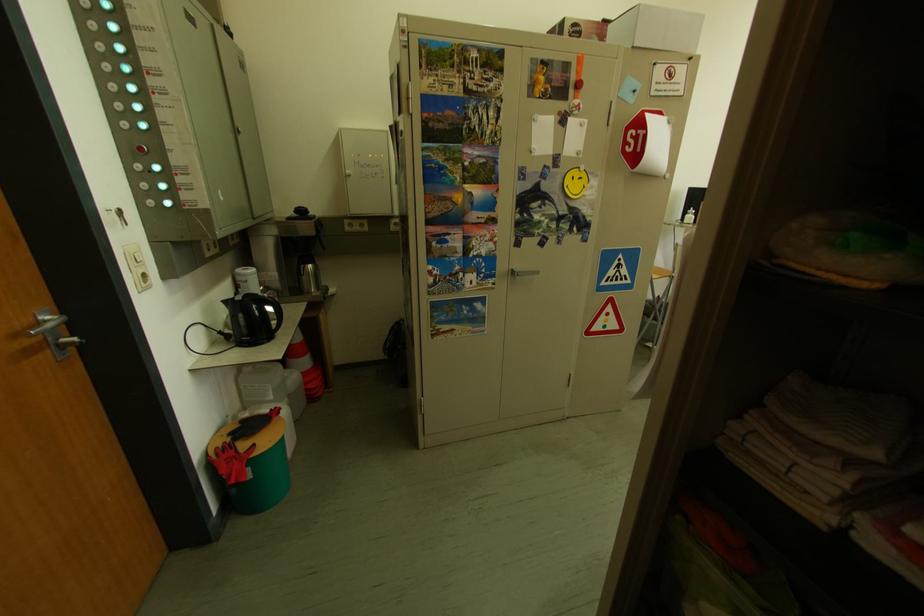
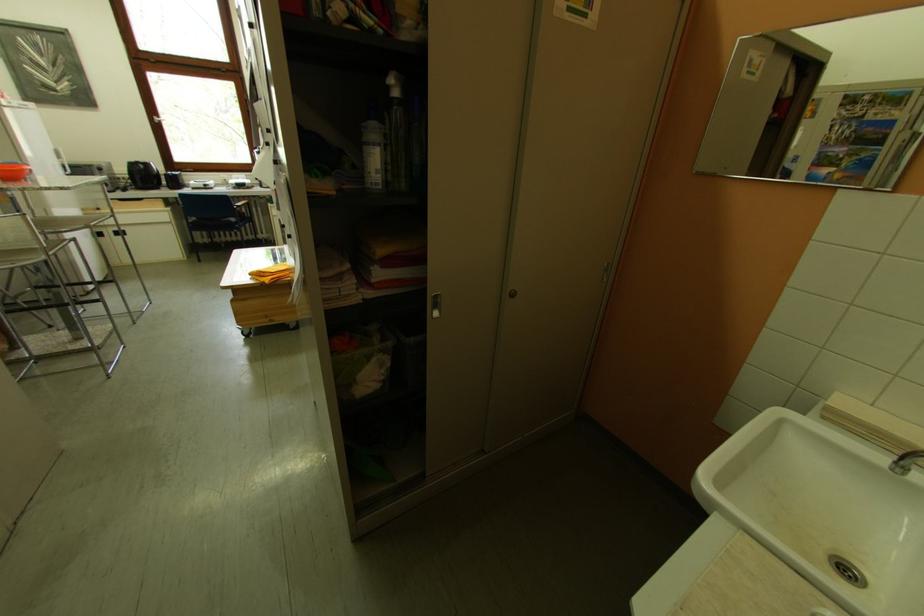
Looking at this image, how did the camera likely rotate?

The camera's rotation is toward right-down.